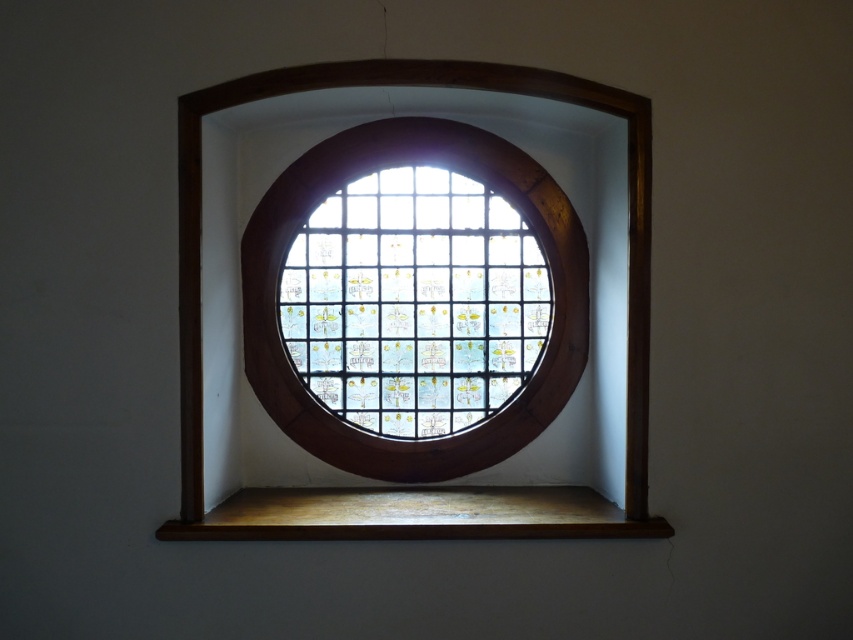
You are an interior designer planning to hang a large painting. You see the stained glass window at center and the wooden at lower center. Which object is taller and can accommodate a larger artwork above it?

The stained glass window at center is much taller than the wooden at lower center, so it can accommodate a larger artwork above it.

You are an interior designer planning to place a 1.2 meter wide decorative mirror next to the stained glass window at center. Considering the brown wood frame at center, can the mirror fit alongside without overlapping the frame?

The stained glass window at center has a lesser width compared to brown wood frame at center. Since the mirror is 1.2 meters wide, and the stained glass window at center is narrower than the brown wood frame at center, the mirror may fit alongside the frame if there is sufficient space between them. However, the exact fit depends on the actual dimensions of the frame and available space.

You are an interior designer planning to place a large painting on the wall near the stained glass window at center and the wooden at lower center. Based on their widths, which object should you consider for positioning the painting to ensure it doesn

The stained glass window at center has a lesser width compared to wooden at lower center, so you should position the painting near the wooden at lower center to accommodate its larger width.